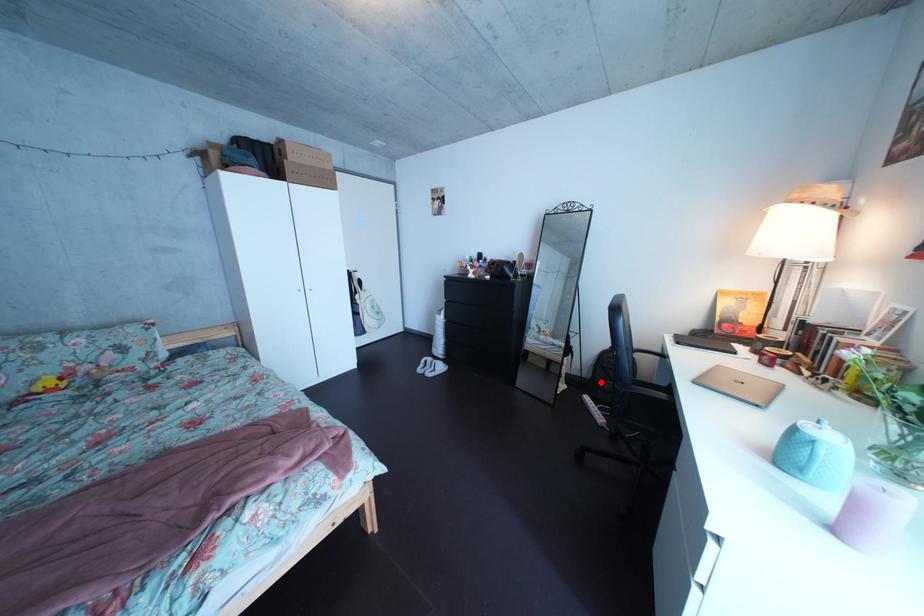
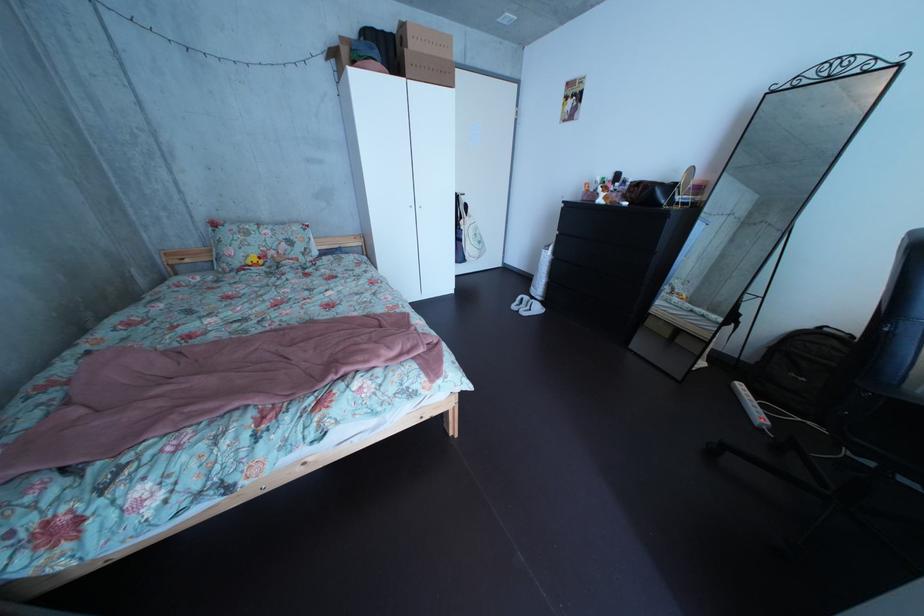
Where in the second image is the point corresponding to the highlighted location from the first image?

(763, 363)